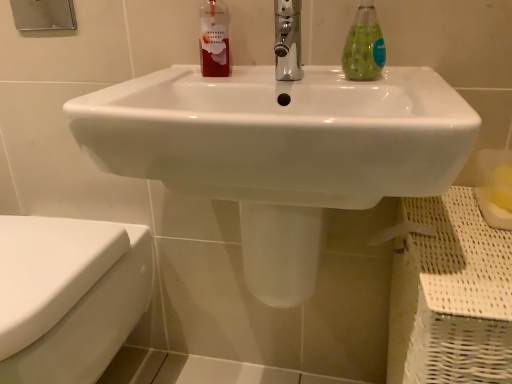
Identify the location of vacant region to the left of translucent green liquid at sink right. Image resolution: width=512 pixels, height=384 pixels. (293, 78).